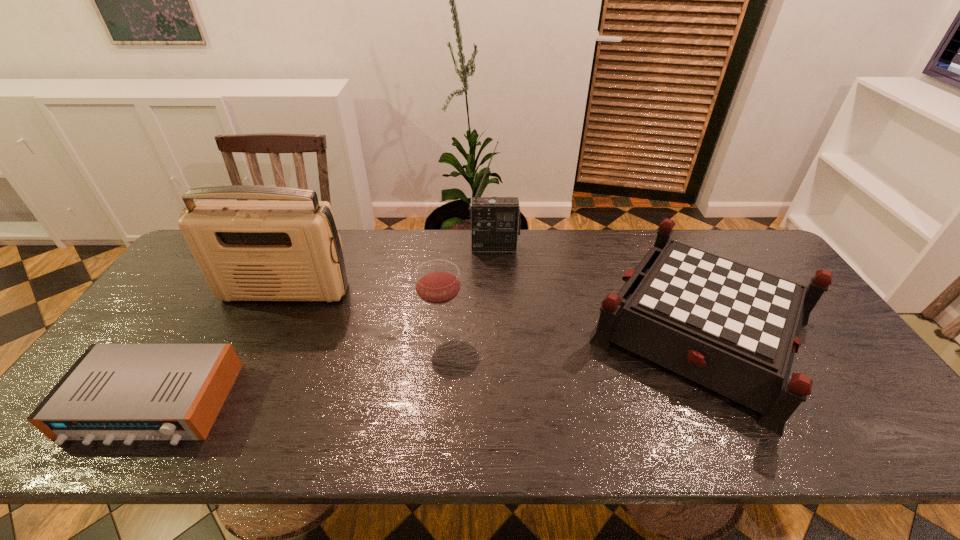
You are a GUI agent. You are given a task and a screenshot of the screen. Output one action in this format:
    pyautogui.click(x=<x>, y=<y>)
    Task: Click on the vacant area in the image that satisfies the following two spatial constraints: 1. on the display of the farthest object; 2. on the left side of the rightmost object
    This screenshot has width=960, height=540.
    Given the screenshot: What is the action you would take?
    pyautogui.click(x=498, y=328)

I want to click on vacant region that satisfies the following two spatial constraints: 1. on the display of the fourth object from left to right; 2. on the left side of the checkerboard, so click(x=498, y=328).

Find the location of a particular element. This screenshot has width=960, height=540. vacant space that satisfies the following two spatial constraints: 1. on the display of the rightmost radio receiver; 2. on the left side of the rightmost object is located at coordinates (498, 328).

Find the location of `free location that satisfies the following two spatial constraints: 1. on the front-facing side of the wineglass; 2. on the right side of the second nearest radio receiver`. free location that satisfies the following two spatial constraints: 1. on the front-facing side of the wineglass; 2. on the right side of the second nearest radio receiver is located at coordinates (267, 330).

Find the location of a particular element. This screenshot has width=960, height=540. free space that satisfies the following two spatial constraints: 1. on the back side of the wineglass; 2. on the right side of the second shortest object is located at coordinates (442, 328).